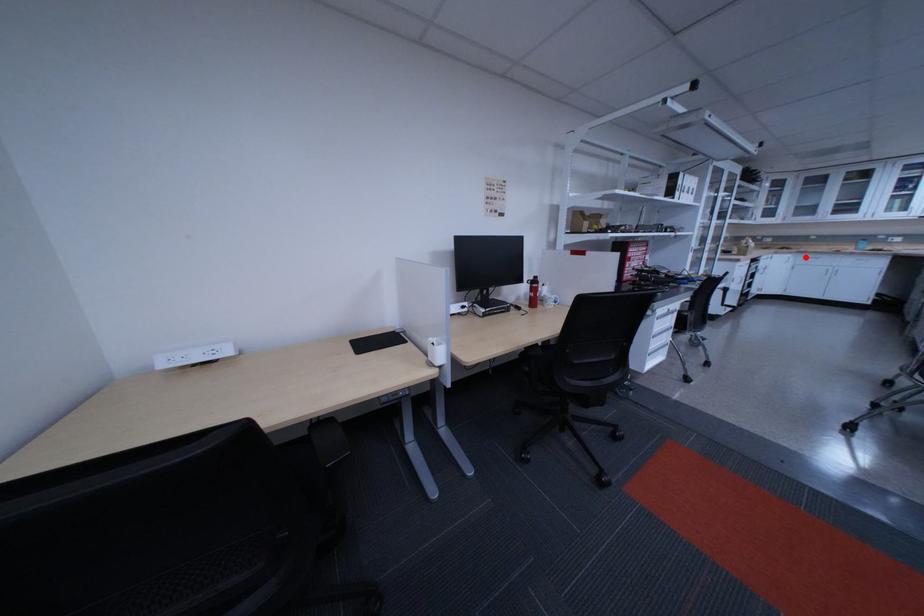
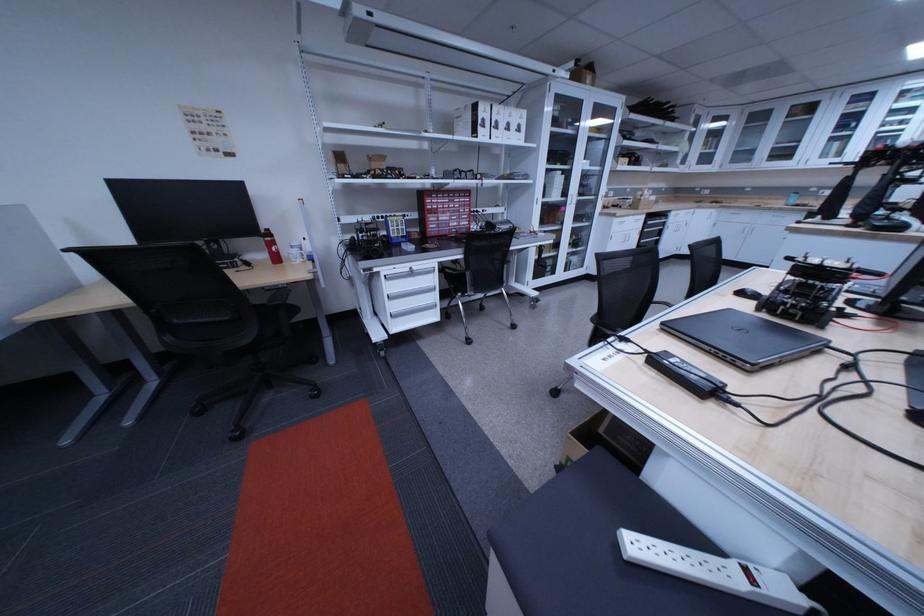
Question: I am providing you with two images of the same scene from different viewpoints. Given a red point in image1, look at the same physical point in image2. Is it:

Choices:
 (A) Closer to the viewpoint
 (B) Farther from the viewpoint

Answer: (A)